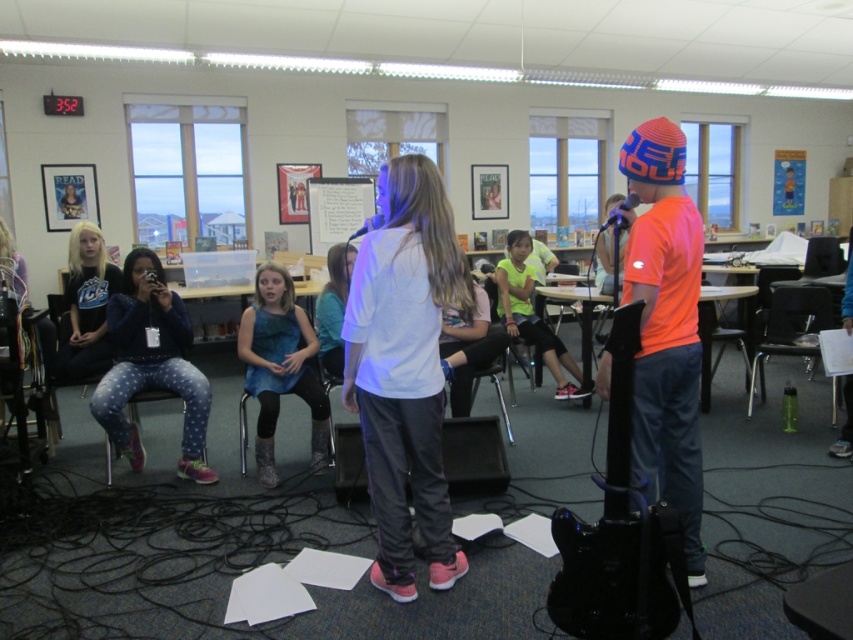
Question: Can you confirm if neon yellow shirt at center is thinner than black plastic chair at lower right?

Choices:
 (A) no
 (B) yes

Answer: (B)

Question: From the image, what is the correct spatial relationship of black glossy electric guitar at lower right in relation to matte black shirt at left?

Choices:
 (A) right
 (B) left

Answer: (A)

Question: Which object is the closest to the black plastic chair at lower right?

Choices:
 (A) white matte shirt at center
 (B) black glossy electric guitar at lower right
 (C) blue polka dot jeans at left

Answer: (B)

Question: Which object is closer to the camera taking this photo?

Choices:
 (A) teal fabric dress at center
 (B) metallic silver chair at lower right

Answer: (A)

Question: Which point appears farthest from the camera in this image?

Choices:
 (A) (253, 362)
 (B) (610, 429)

Answer: (A)

Question: Is black glossy electric guitar at lower right further to camera compared to teal fabric dress at center?

Choices:
 (A) yes
 (B) no

Answer: (B)